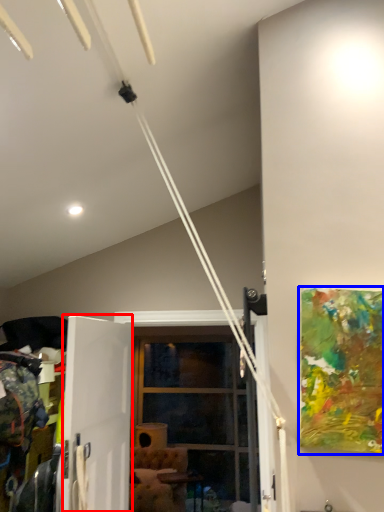
Question: Which object is closer to the camera taking this photo, screen door (highlighted by a red box) or picture frame (highlighted by a blue box)?

Choices:
 (A) screen door
 (B) picture frame

Answer: (B)